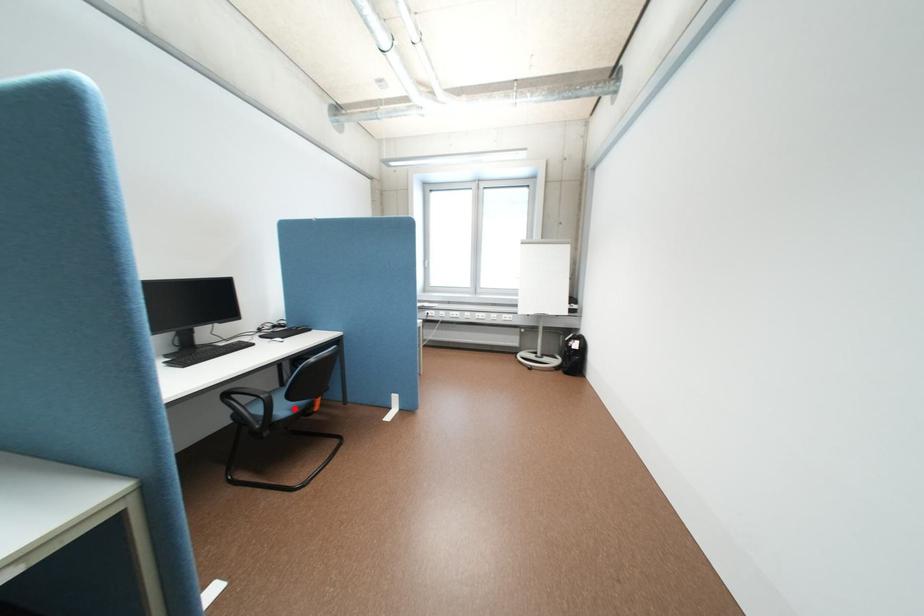
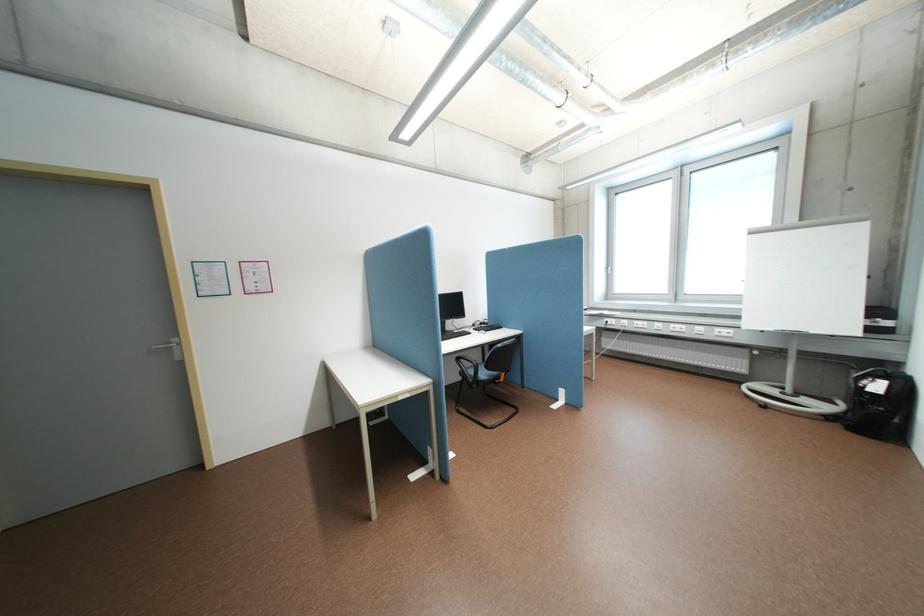
Question: I am providing you with two images of the same scene from different viewpoints. A red point is marked on the first image. Is the red point's position out of view in image 2?

Choices:
 (A) Yes
 (B) No

Answer: (B)